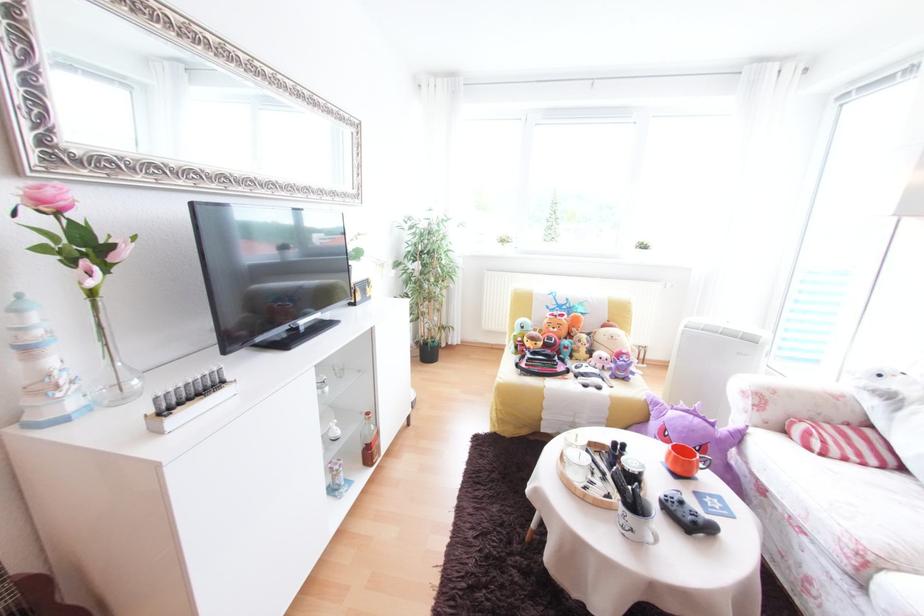
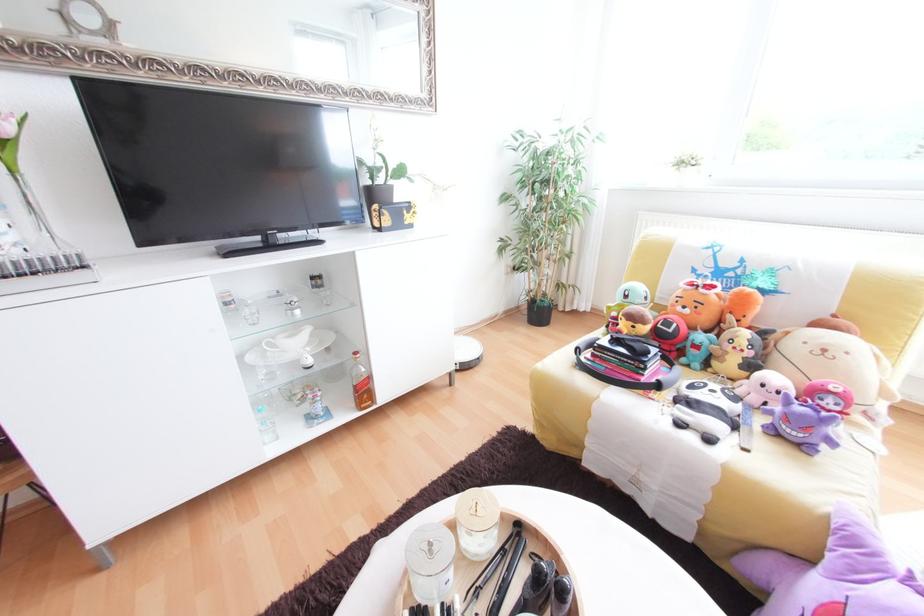
In the second image, find the point that corresponds to point (549, 342) in the first image.

(652, 323)